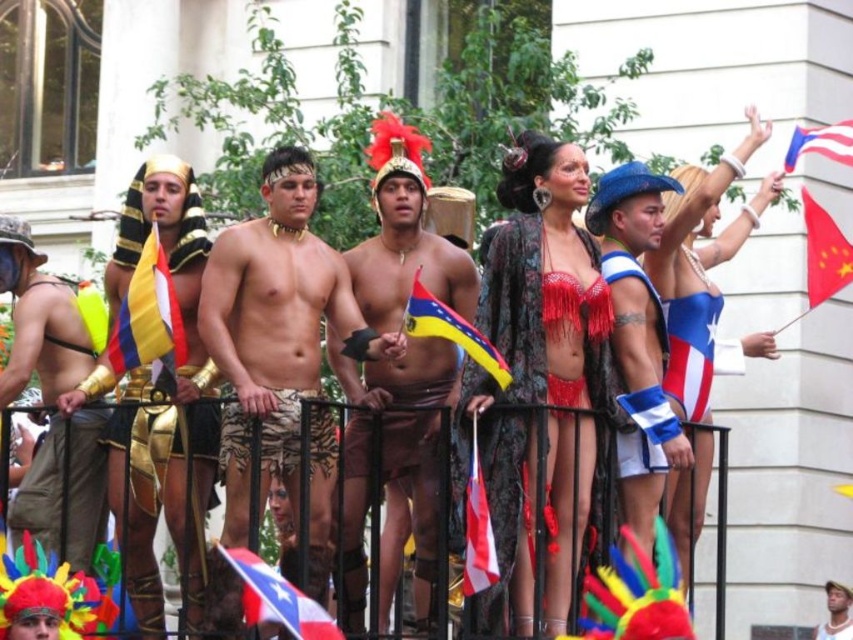
Does gold metallic armor at left lie in front of red fabric flag at center?

No, it is not.

Is point (186, 243) positioned behind point (477, 557)?

Yes, it is.

At what (x,y) coordinates should I click in order to perform the action: click on gold metallic armor at left. Please return your answer as a coordinate pair (x, y). This screenshot has height=640, width=853. Looking at the image, I should click on (149, 220).

Is white fabric flag at lower center below red fabric flag at upper right?

Yes, white fabric flag at lower center is below red fabric flag at upper right.

Between white fabric flag at lower center and red fabric flag at upper right, which one has less height?

Standing shorter between the two is white fabric flag at lower center.

Between point (254, 563) and point (810, 241), which one is positioned behind?

The point (810, 241) is more distant.

Locate an element on the screen. white fabric flag at lower center is located at coordinates (277, 598).

Which of these two, yellow and blue fabric flag at left or gold metallic armor at left, stands taller?

gold metallic armor at left is taller.

This screenshot has height=640, width=853. What do you see at coordinates (148, 320) in the screenshot?
I see `yellow and blue fabric flag at left` at bounding box center [148, 320].

This screenshot has width=853, height=640. What are the coordinates of `yellow and blue fabric flag at left` in the screenshot? It's located at (148, 320).